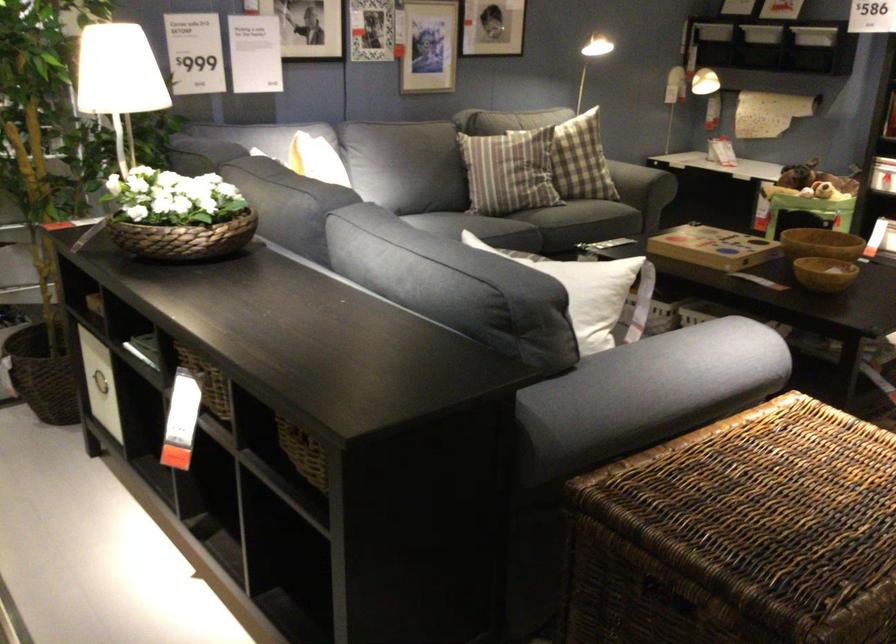
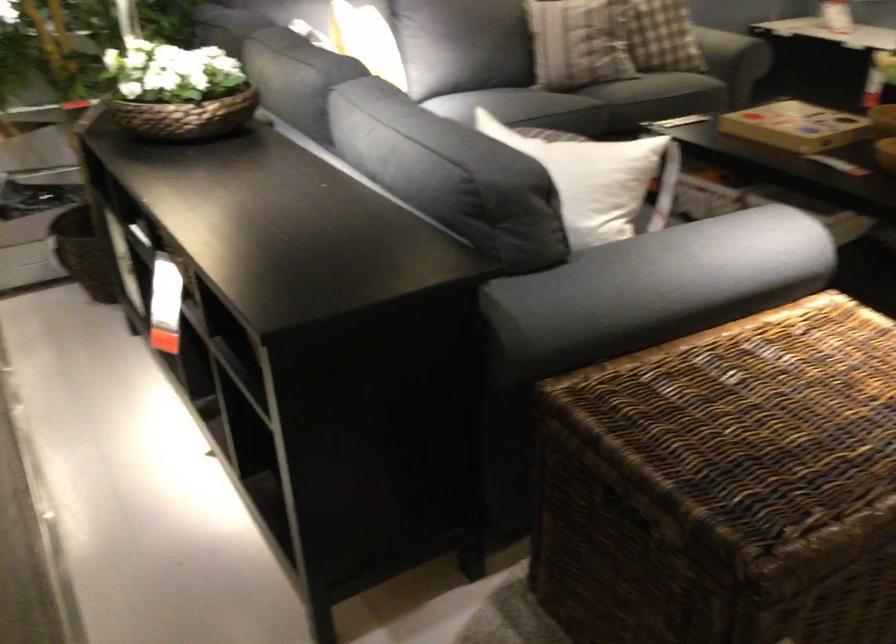
The images are taken continuously from a first-person perspective. In which direction are you moving?

The cameraman walked toward right, forward.